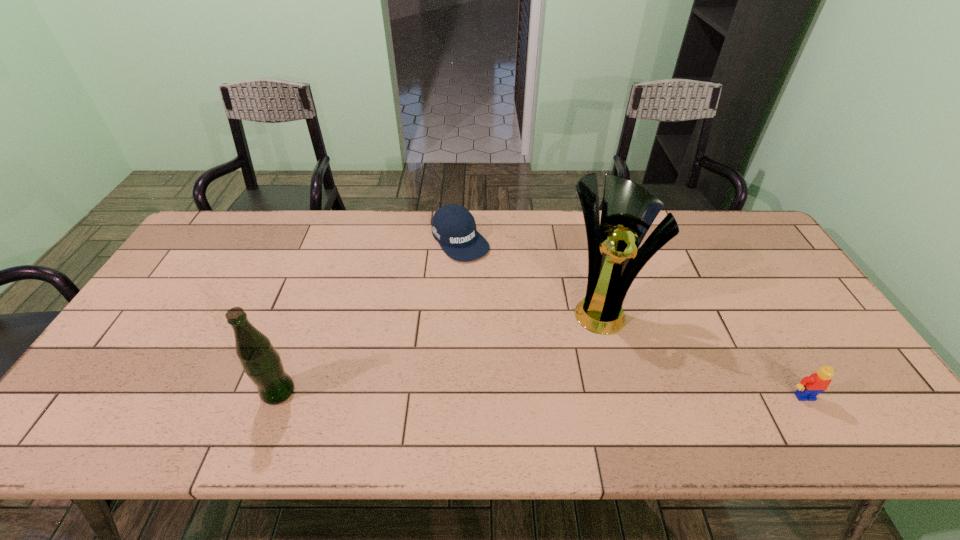
Image resolution: width=960 pixels, height=540 pixels. What are the coordinates of `vacant spot on the desktop that is between the third shortest object and the Lego and is positioned at the front of the award, where the globe is visible` in the screenshot? It's located at (586, 394).

Find the location of `free space on the desktop that is between the beer bottle and the rightmost object and is positioned on the front-facing side of the farthest object`. free space on the desktop that is between the beer bottle and the rightmost object and is positioned on the front-facing side of the farthest object is located at coordinates (593, 395).